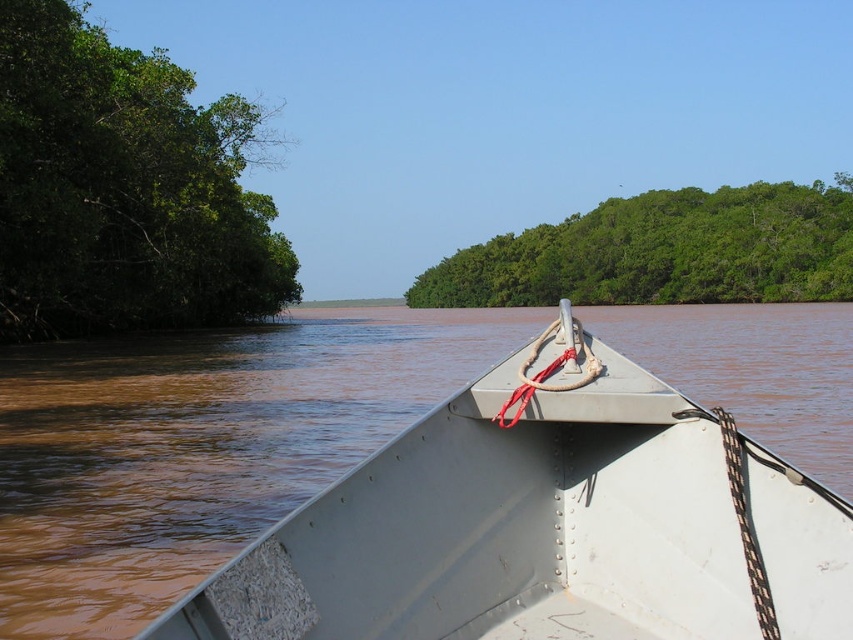
You are sitting in the boat and want to point out two specific locations in the scene. The first is at point [137,72] and the second is at point [811,298]. Which of these two points is closer to you?

Point [137,72] is closer to the viewer than point [811,298].